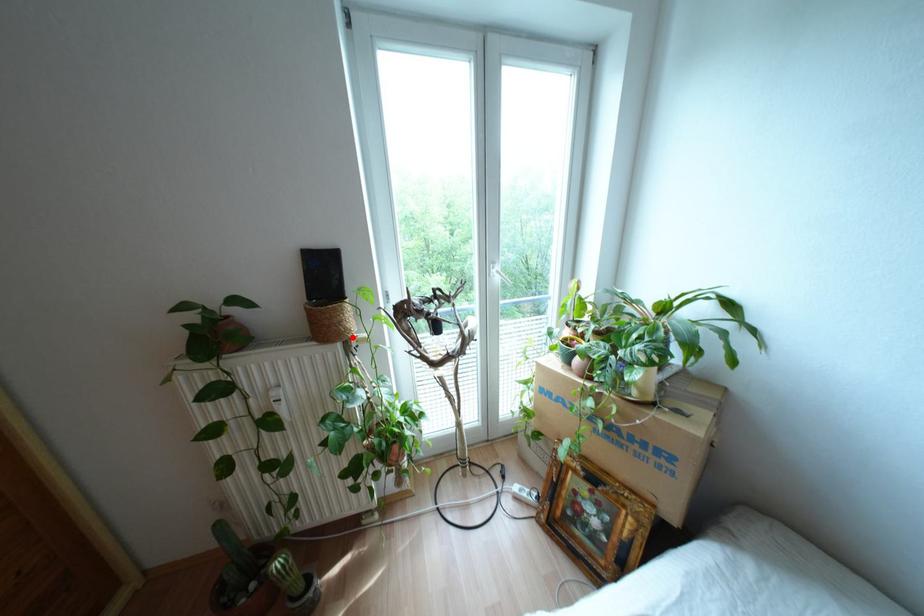
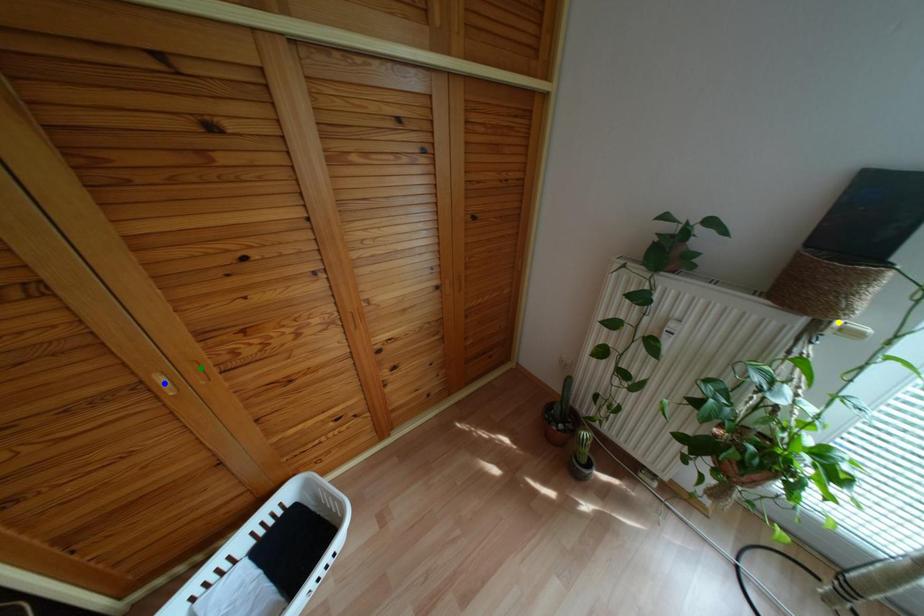
Question: I am providing you with two images of the same scene from different viewpoints. A red point is marked on the first image. You are given multiple points on the second image. In image 2, which mark is for the same physical point as the one in image 1?

Choices:
 (A) blue point
 (B) green point
 (C) yellow point

Answer: (C)